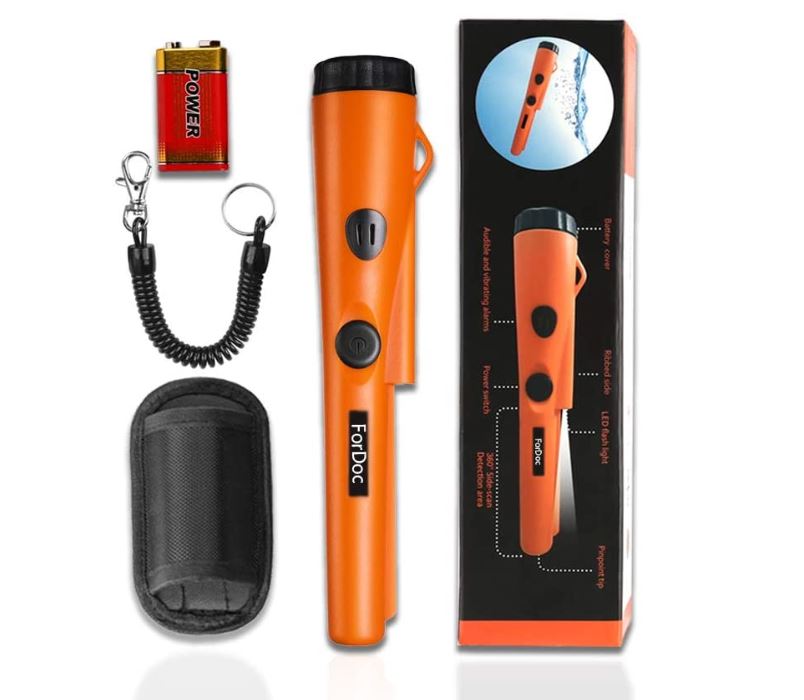
Find the location of a particular element. The width and height of the screenshot is (804, 700). box is located at coordinates (605, 190).